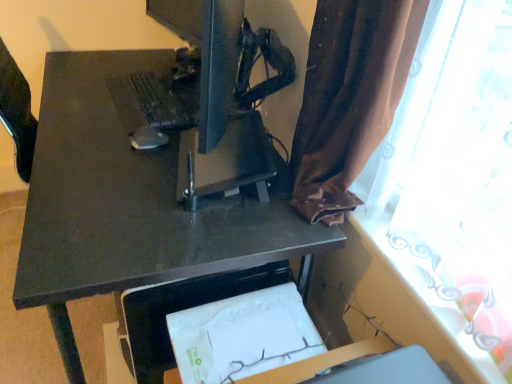
This screenshot has height=384, width=512. I want to click on vacant space that is to the left of matte black mouse at center, so click(93, 135).